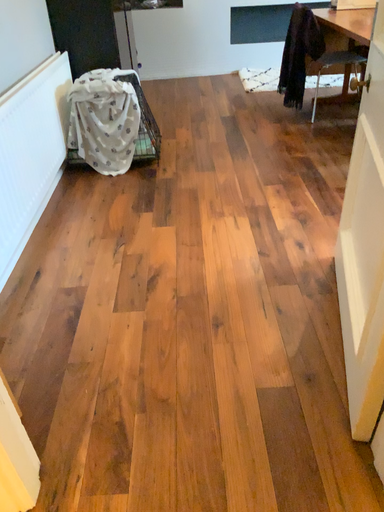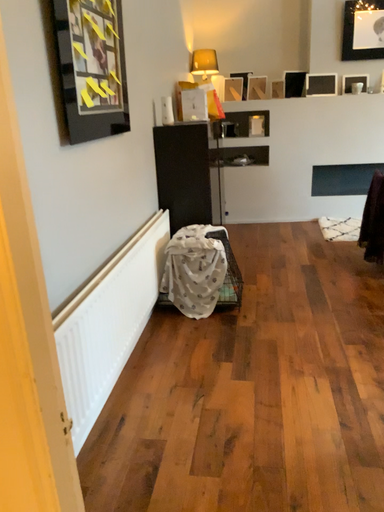
Question: Which way did the camera rotate in the video?

Choices:
 (A) rotated upward
 (B) rotated downward

Answer: (A)